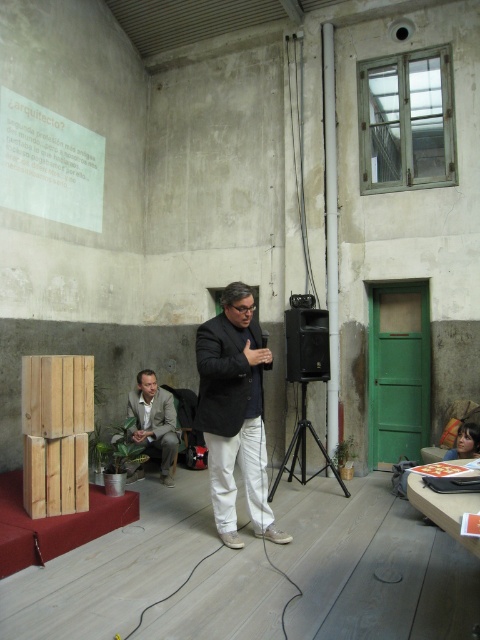
Question: Is light brown fabric suit at lower left wider than black metal tripod at center?

Choices:
 (A) no
 (B) yes

Answer: (A)

Question: Which object appears farthest from the camera in this image?

Choices:
 (A) black matte speaker at center
 (B) matte black suit at center
 (C) black metal tripod at center

Answer: (A)

Question: Which is nearer to the black matte speaker at center?

Choices:
 (A) matte black suit at center
 (B) black metal tripod at center
 (C) light brown fabric suit at lower left

Answer: (B)

Question: Does light brown fabric suit at lower left have a lesser width compared to black metal tripod at center?

Choices:
 (A) yes
 (B) no

Answer: (A)

Question: Which point is closer to the camera taking this photo?

Choices:
 (A) (324, 314)
 (B) (249, 440)
 (C) (169, 396)

Answer: (B)

Question: Is matte black suit at center below black metal tripod at center?

Choices:
 (A) yes
 (B) no

Answer: (B)